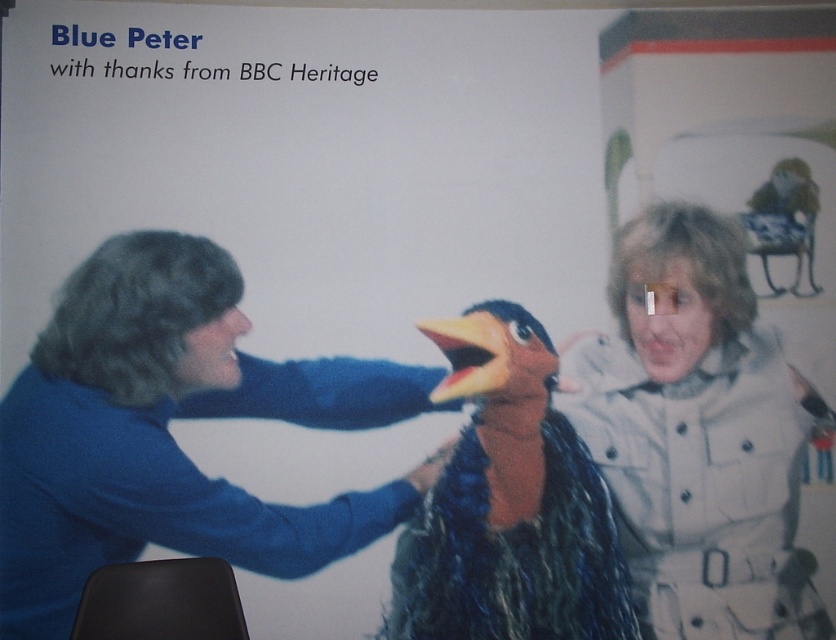
Question: Among these objects, which one is farthest from the camera?

Choices:
 (A) blue velvet sweater at left
 (B) fuzzy brown penguin at center
 (C) light beige textured coat at right

Answer: (C)

Question: Which is nearer to the blue velvet sweater at left?

Choices:
 (A) light beige textured coat at right
 (B) fuzzy brown penguin at center

Answer: (B)

Question: Which of the following is the farthest from the observer?

Choices:
 (A) (260, 522)
 (B) (553, 385)
 (C) (748, 548)

Answer: (B)

Question: Does blue velvet sweater at left lie in front of light beige textured coat at right?

Choices:
 (A) no
 (B) yes

Answer: (B)

Question: Does blue velvet sweater at left have a smaller size compared to fuzzy brown penguin at center?

Choices:
 (A) no
 (B) yes

Answer: (A)

Question: Can you confirm if light beige textured coat at right is positioned below fuzzy brown penguin at center?

Choices:
 (A) no
 (B) yes

Answer: (A)